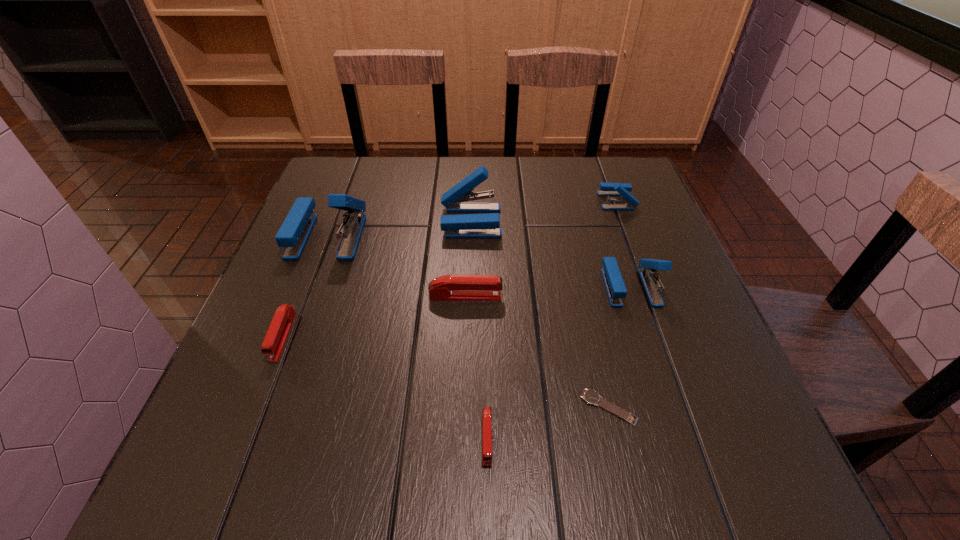
You are a GUI agent. You are given a task and a screenshot of the screen. Output one action in this format:
    pyautogui.click(x=<x>, y=<y>)
    Task: Click on the leftmost blue stapler
    The height and width of the screenshot is (540, 960).
    Given the screenshot: What is the action you would take?
    pyautogui.click(x=293, y=234)

Locate an element on the screen. This screenshot has width=960, height=540. the biggest blue stapler is located at coordinates (293, 234).

Where is `the third blue stapler from right to left`? Image resolution: width=960 pixels, height=540 pixels. the third blue stapler from right to left is located at coordinates (487, 225).

In order to click on the second tallest stapler in this screenshot , I will do `click(487, 225)`.

The height and width of the screenshot is (540, 960). Find the location of `the nearest blue stapler`. the nearest blue stapler is located at coordinates (616, 290).

The width and height of the screenshot is (960, 540). Identify the location of the second smallest blue stapler. (616, 290).

The height and width of the screenshot is (540, 960). Find the location of `the smallest blue stapler`. the smallest blue stapler is located at coordinates pos(630,202).

Where is `the fourth tallest stapler`? The image size is (960, 540). the fourth tallest stapler is located at coordinates (630, 202).

Where is `the fifth tallest stapler`? This screenshot has height=540, width=960. the fifth tallest stapler is located at coordinates (448, 287).

The width and height of the screenshot is (960, 540). I want to click on the fifth tallest object, so click(x=448, y=287).